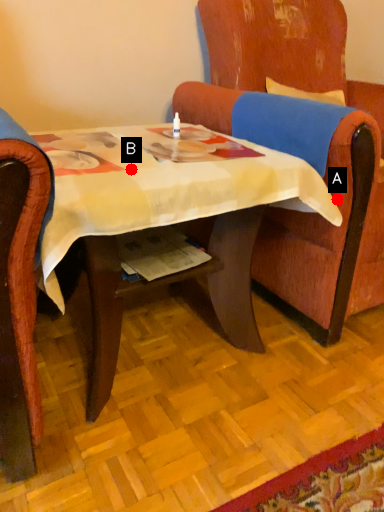
Question: Two points are circled on the image, labeled by A and B beside each circle. Among these points, which one is nearest to the camera?

Choices:
 (A) A is closer
 (B) B is closer

Answer: (B)